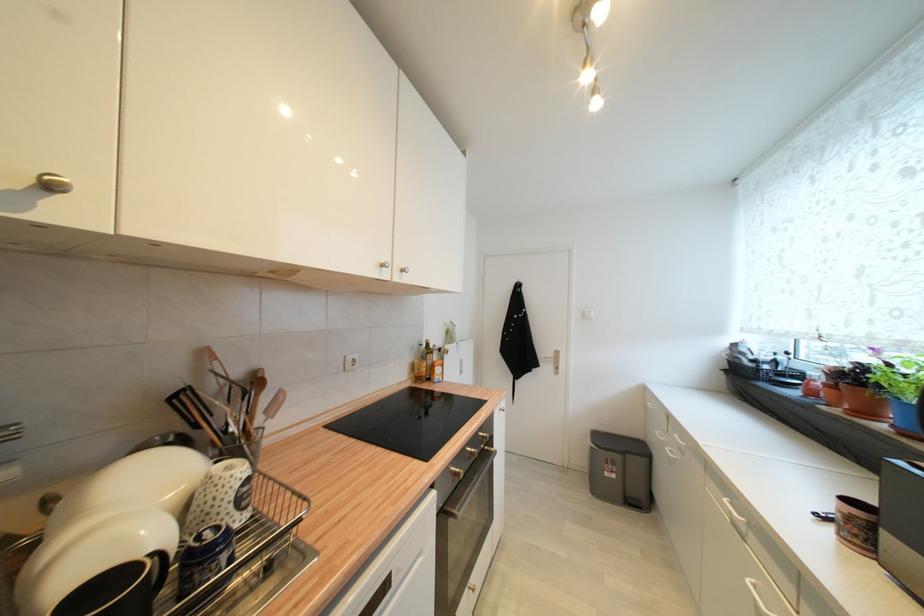
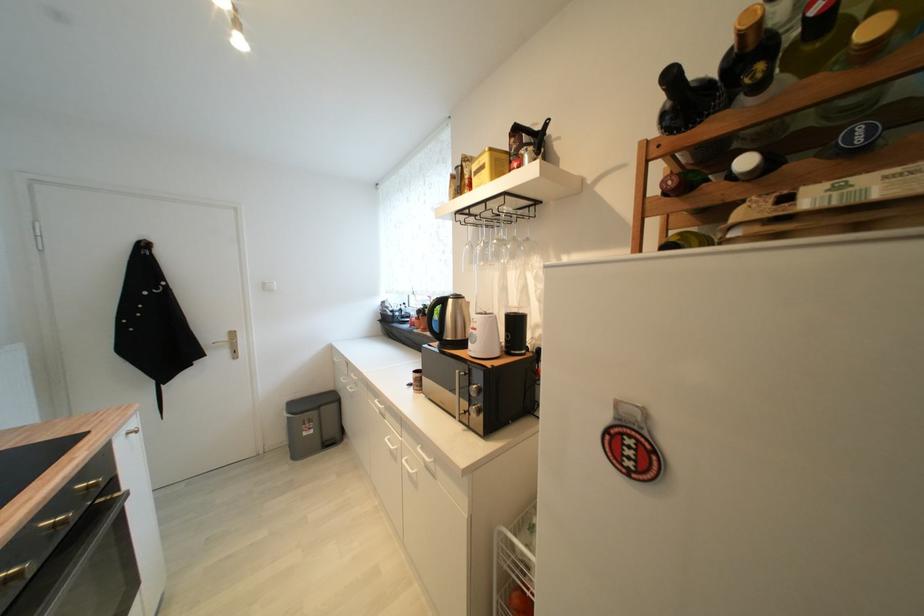
In the second image, find the point that corresponds to (x=590, y=317) in the first image.

(271, 289)